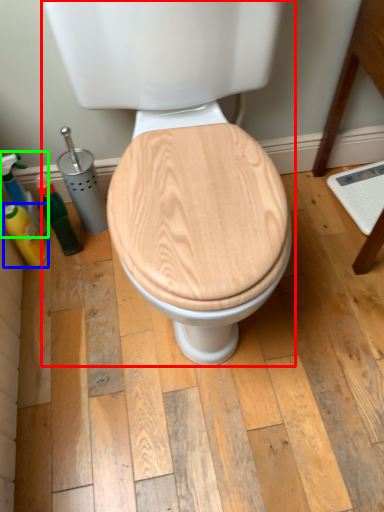
Question: Which object is positioned farthest from toilet (highlighted by a red box)? Select from cleaning product (highlighted by a blue box) and cleaning product (highlighted by a green box).

Choices:
 (A) cleaning product
 (B) cleaning product

Answer: (A)